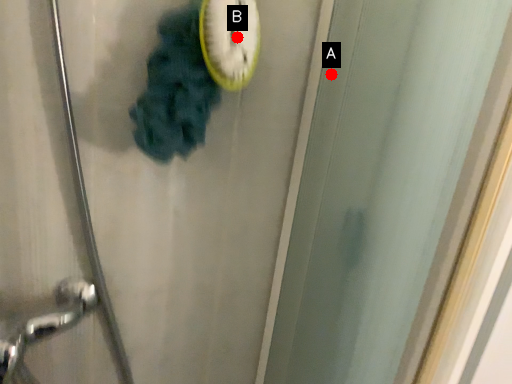
Question: Two points are circled on the image, labeled by A and B beside each circle. Which point is closer to the camera?

Choices:
 (A) A is closer
 (B) B is closer

Answer: (B)